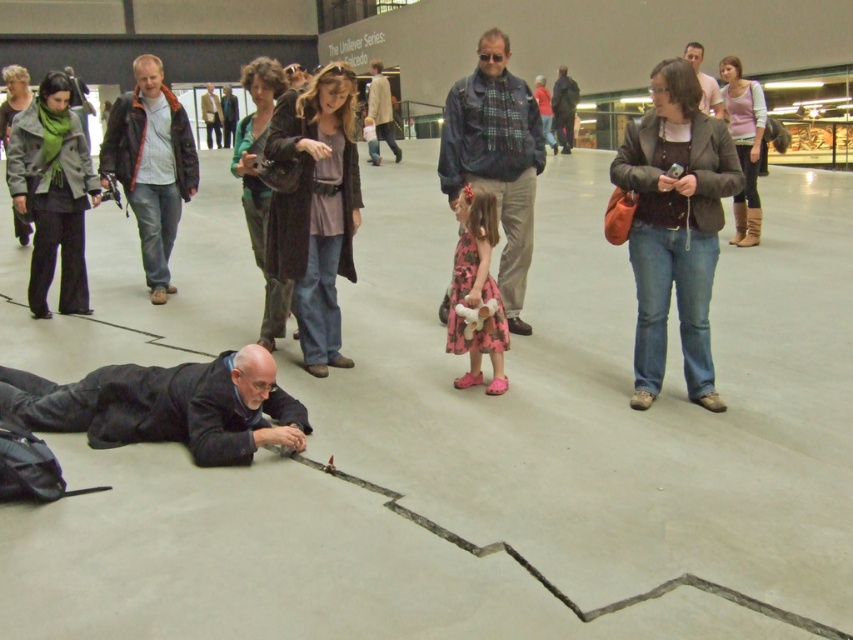
You are an artist planning to install a new piece in the gallery. You need to place a large sculpture that requires a flat surface. Which object between the dark blue fabric at lower left and the dark blue jacket at upper center would be more suitable as a base for the sculpture?

The dark blue jacket at upper center is larger than the dark blue fabric at lower left, making it a more suitable base for the sculpture.

You are an art curator in the gallery and need to position a small sculpture between the dark blue fabric at lower left and the matte black jacket at center. Based on their positions, where should you place the sculpture?

The dark blue fabric at lower left is located below the matte black jacket at center, so the sculpture should be placed between them in the space below the matte black jacket at center and above the dark blue fabric at lower left.